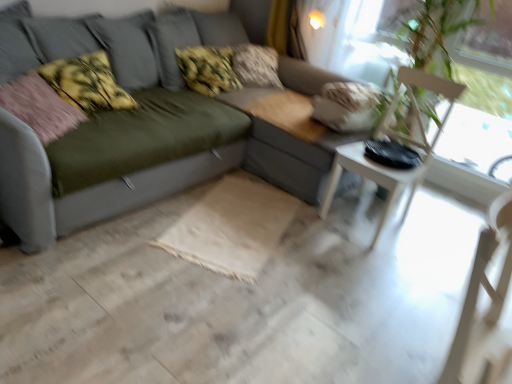
Locate an element on the screen. This screenshot has height=384, width=512. free location in front of white wood chair at right, which ranks as the second armchair in front-to-back order is located at coordinates (380, 259).